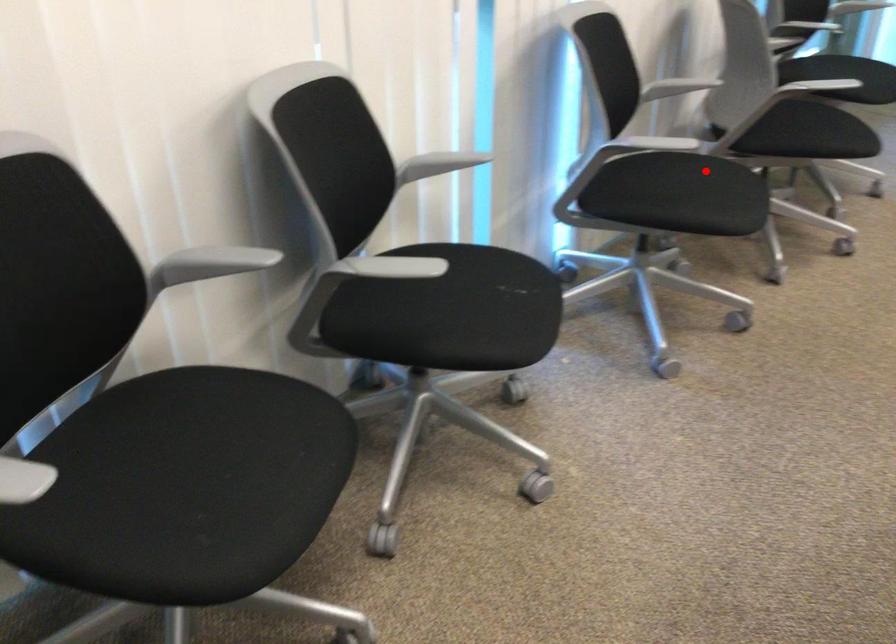
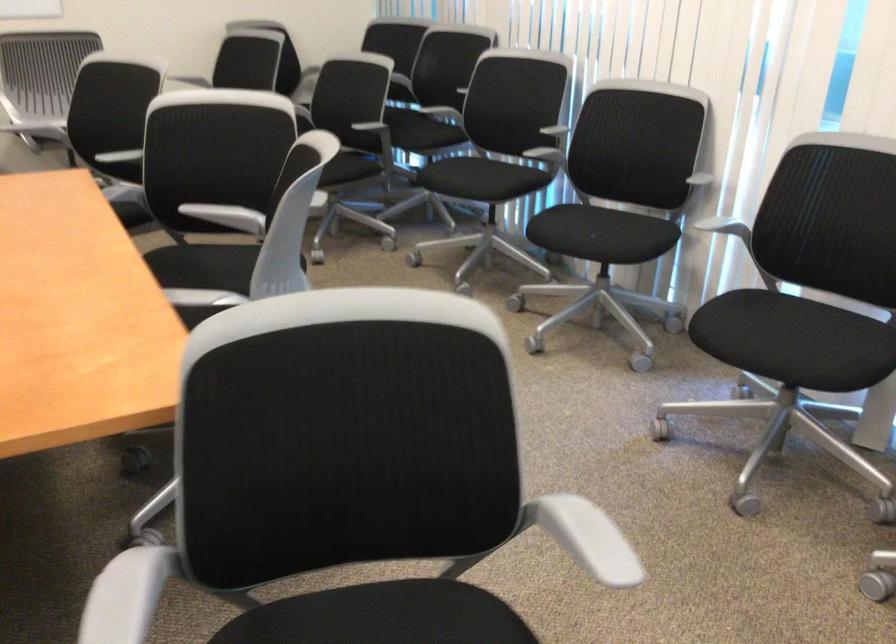
Question: I am providing you with two images of the same scene from different viewpoints. In image1, a red point is highlighted. Considering the same 3D point in image2, which of the following is correct?

Choices:
 (A) It is closer
 (B) It is farther

Answer: (A)